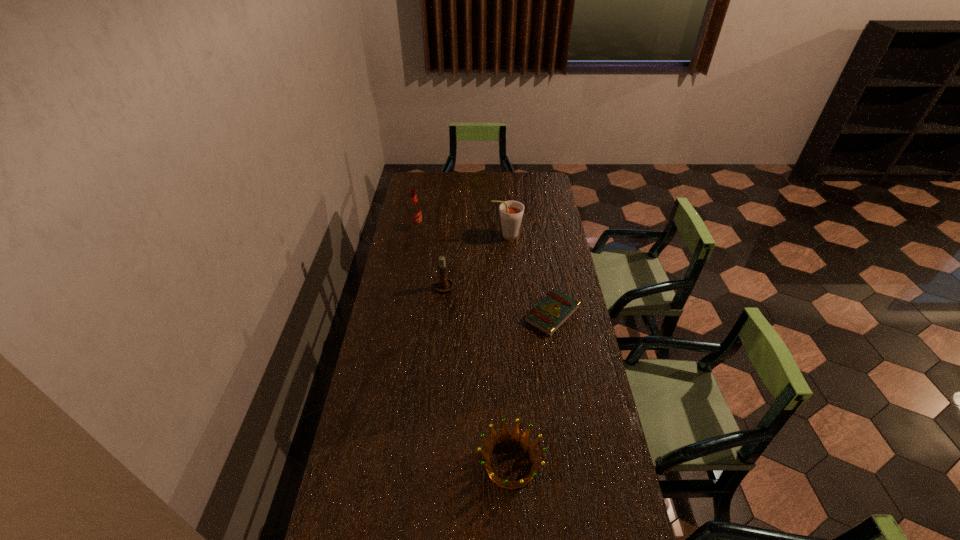
You are a GUI agent. You are given a task and a screenshot of the screen. Output one action in this format:
    pyautogui.click(x=<x>, y=<y>)
    Task: Click on the vacant space located 0.130m on the front of the leftmost object
    
    Given the screenshot: What is the action you would take?
    pyautogui.click(x=414, y=247)

Identify the location of vacant space located 0.260m on the side of the fourth object from right to left with the handle. This screenshot has width=960, height=540. (448, 240).

You are a GUI agent. You are given a task and a screenshot of the screen. Output one action in this format:
    pyautogui.click(x=<x>, y=<y>)
    Task: Click on the free space located on the side of the fourth object from right to left with the handle
    
    Given the screenshot: What is the action you would take?
    pyautogui.click(x=445, y=265)

Image resolution: width=960 pixels, height=540 pixels. I want to click on vacant point located 0.070m on the side of the fourth object from right to left with the handle, so click(445, 266).

You are a GUI agent. You are given a task and a screenshot of the screen. Output one action in this format:
    pyautogui.click(x=<x>, y=<y>)
    Task: Click on the vacant space located on the left of the nearest object
    This screenshot has width=960, height=540.
    Given the screenshot: What is the action you would take?
    pyautogui.click(x=396, y=464)

The image size is (960, 540). I want to click on vacant area situated 0.380m on the front of the shortest object, so click(x=571, y=429).

This screenshot has width=960, height=540. What are the coordinates of `object situated at the left edge` in the screenshot? It's located at (415, 213).

Where is `object at the right edge`? This screenshot has width=960, height=540. object at the right edge is located at coordinates (x=548, y=315).

The width and height of the screenshot is (960, 540). Find the location of `free location at the far edge of the desktop`. free location at the far edge of the desktop is located at coordinates (447, 193).

Where is `vacant space at the left edge`? This screenshot has width=960, height=540. vacant space at the left edge is located at coordinates (424, 208).